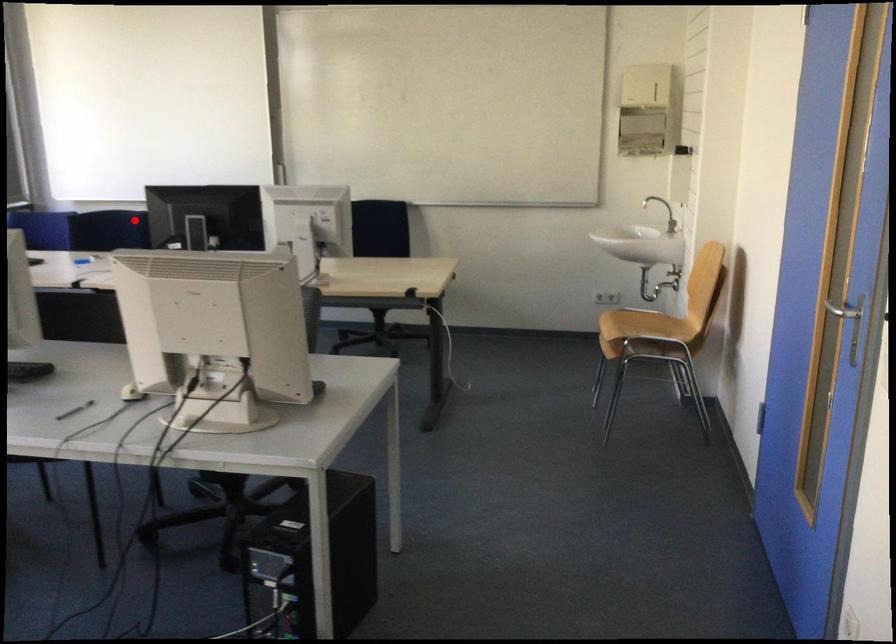
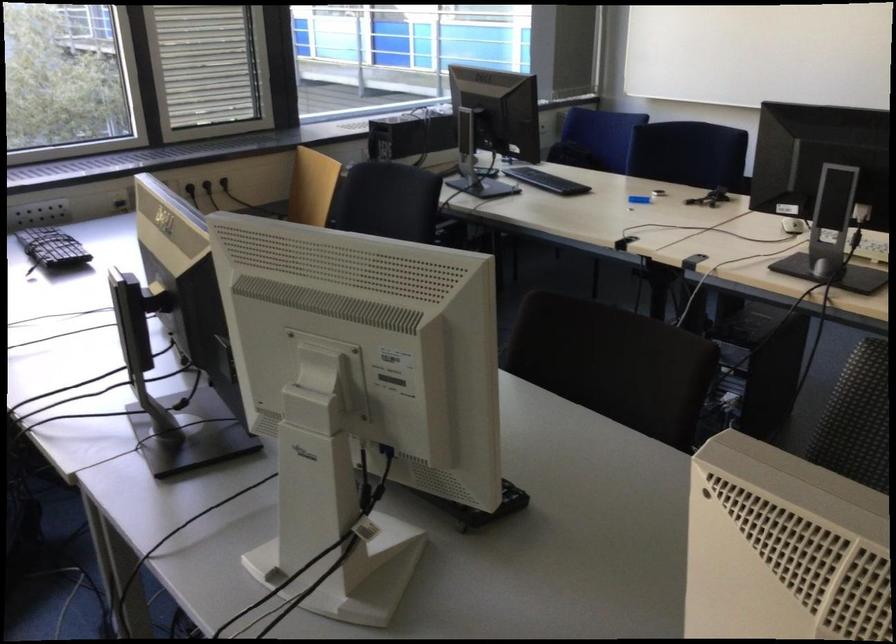
Where in the second image is the point corresponding to the highlighted location from the first image?

(687, 153)